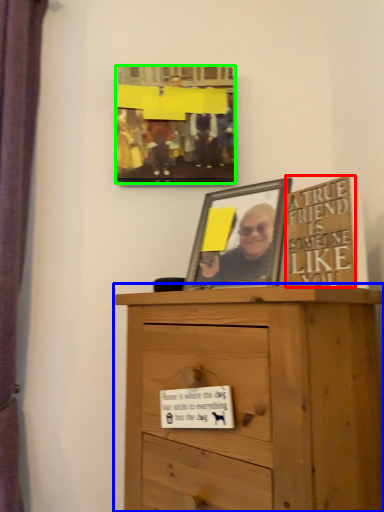
Question: Considering the real-world distances, which object is closest to writing (highlighted by a red box)? chest of drawers (highlighted by a blue box) or picture frame (highlighted by a green box).

Choices:
 (A) chest of drawers
 (B) picture frame

Answer: (A)